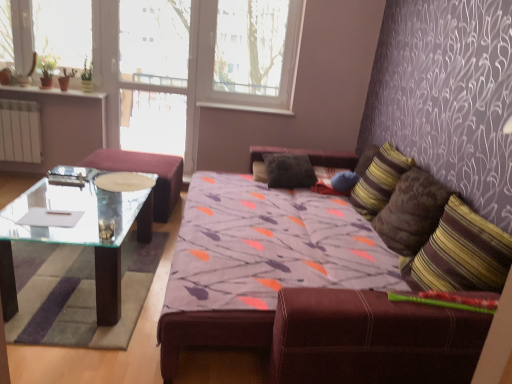
In order to face green glass window screen at upper left, should I rotate leftwards or rightwards?

It's best to rotate left around 25.831 degrees.

Describe the element at coordinates (289, 170) in the screenshot. Image resolution: width=512 pixels, height=384 pixels. I see `black fabric pillow at center, the 3th pillow when ordered from right to left` at that location.

Identify the location of black fabric pillow at center, marked as the first pillow in a back-to-front arrangement. coord(289,170).

Where is `transparent glass coffee table at left`? The height and width of the screenshot is (384, 512). transparent glass coffee table at left is located at coordinates (78, 234).

What is the approximate width of striped fabric pillow at right, the second pillow when ordered from front to back?

The width of striped fabric pillow at right, the second pillow when ordered from front to back, is 13.93 inches.

In order to face striped fabric pillow at right, the second pillow when ordered from front to back, should I rotate leftwards or rightwards?

You should look right and rotate roughly 16.209 degrees.

The height and width of the screenshot is (384, 512). Describe the element at coordinates (145, 172) in the screenshot. I see `transparent glass table at left` at that location.

I want to click on striped fabric pillow at right, so click(x=461, y=253).

In order to click on white paper at left in this screenshot , I will do `click(50, 218)`.

Is striped fabric pillow at right next to green glass window screen at upper left?

No, striped fabric pillow at right is not in contact with green glass window screen at upper left.

From the image's perspective, which object appears higher, striped fabric pillow at right or green glass window screen at upper left?

green glass window screen at upper left, from the image's perspective.

Is striped fabric pillow at right located outside green glass window screen at upper left?

Yes, striped fabric pillow at right is outside of green glass window screen at upper left.

Considering the points (452, 226) and (74, 36), which point is behind, point (452, 226) or point (74, 36)?

The point (74, 36) is farther from the camera.

Is transparent glass coffee table at left with white plastic window frame at upper center?

No, transparent glass coffee table at left is not in contact with white plastic window frame at upper center.

From a real-world perspective, which object stands above the other?

white plastic window frame at upper center.

Where is `coffee table below the white plastic window frame at upper center (from the image's perspective)`? This screenshot has width=512, height=384. coffee table below the white plastic window frame at upper center (from the image's perspective) is located at coordinates (78, 234).

From the picture: Which object is positioned more to the right, white paper at left or striped fabric pillow at right?

striped fabric pillow at right is more to the right.

Can you see white paper at left touching striped fabric pillow at right?

white paper at left is not next to striped fabric pillow at right, and they're not touching.

In the image, is white paper at left positioned in front of or behind striped fabric pillow at right?

white paper at left is behind striped fabric pillow at right.

Who is smaller, white paper at left or striped fabric pillow at right?

white paper at left.

Is the depth of white paper at left greater than that of brown textured pillow at right, the first pillow positioned from the right?

No, it is not.

Can you confirm if white paper at left is taller than brown textured pillow at right, which is counted as the 3th pillow, starting from the left?

In fact, white paper at left may be shorter than brown textured pillow at right, which is counted as the 3th pillow, starting from the left.

Would you say white paper at left is to the left or to the right of brown textured pillow at right, acting as the 3th pillow starting from the back, in the picture?

Based on their positions, white paper at left is located to the left of brown textured pillow at right, acting as the 3th pillow starting from the back.

How far apart are white paper at left and brown textured pillow at right, acting as the 3th pillow starting from the back?

The distance of white paper at left from brown textured pillow at right, acting as the 3th pillow starting from the back, is 7.49 feet.

Which of these two, transparent glass table at left or green glass window screen at upper left, is thinner?

With smaller width is green glass window screen at upper left.

Consider the image. Is transparent glass table at left oriented towards green glass window screen at upper left?

No, transparent glass table at left is not oriented towards green glass window screen at upper left.

Is point (174, 164) farther from camera compared to point (58, 22)?

No, (174, 164) is closer to viewer.

Considering the positions of objects transparent glass table at left and green glass window screen at upper left in the image provided, who is in front, transparent glass table at left or green glass window screen at upper left?

Positioned in front is transparent glass table at left.

Where is `pad on the left of the white plastic window sill at upper center`? The width and height of the screenshot is (512, 384). pad on the left of the white plastic window sill at upper center is located at coordinates (50, 218).

Considering the sizes of objects white plastic window sill at upper center and white paper at left in the image provided, who is shorter, white plastic window sill at upper center or white paper at left?

white paper at left is shorter.

From a real-world perspective, who is located higher, white plastic window sill at upper center or white paper at left?

white plastic window sill at upper center, from a real-world perspective.

From the image's perspective, who appears lower, white plastic window sill at upper center or white paper at left?

white paper at left, from the image's perspective.

Could you tell me if white plastic window sill at upper center is turned towards striped fabric pillow at right?

No, white plastic window sill at upper center does not turn towards striped fabric pillow at right.

From the image's perspective, is white plastic window sill at upper center over striped fabric pillow at right?

Yes.

Is there a large distance between white plastic window sill at upper center and striped fabric pillow at right?

That's right, there is a large distance between white plastic window sill at upper center and striped fabric pillow at right.

Which is more to the left, white plastic window sill at upper center or striped fabric pillow at right?

white plastic window sill at upper center is more to the left.

Where is `window screen on the left of striped fabric pillow at right`? window screen on the left of striped fabric pillow at right is located at coordinates [x=63, y=32].

In order to click on coffee table below the white plastic window frame at upper center (from a real-world perspective) in this screenshot , I will do `click(78, 234)`.

Estimate the real-world distances between objects in this image. Which object is further from white paper at left, transparent glass coffee table at left or black fabric pillow at center, the 3th pillow when ordered from right to left?

black fabric pillow at center, the 3th pillow when ordered from right to left, lies further to white paper at left than the other object.

Based on their spatial positions, is transparent glass table at left or black fabric pillow at center, the 3th pillow when ordered from right to left, further from white plastic window sill at upper center?

transparent glass table at left lies further to white plastic window sill at upper center than the other object.

Which object lies nearer to the anchor point white plastic window sill at upper center, white paper at left or transparent glass table at left?

Among the two, transparent glass table at left is located nearer to white plastic window sill at upper center.

Which object lies further to the anchor point transparent glass coffee table at left, brown textured pillow at right, acting as the 3th pillow starting from the back, or transparent glass door at upper center?

brown textured pillow at right, acting as the 3th pillow starting from the back, lies further to transparent glass coffee table at left than the other object.

Based on their spatial positions, is transparent glass table at left or transparent glass door at upper center further from brown textured pillow at right, acting as the 3th pillow starting from the back?

Among the two, transparent glass door at upper center is located further to brown textured pillow at right, acting as the 3th pillow starting from the back.

Based on their spatial positions, is striped fabric pillow at right or transparent glass coffee table at left closer to white paper at left?

transparent glass coffee table at left is closer to white paper at left.

When comparing their distances from striped fabric pillow at right, does black fabric pillow at center, the 3th pillow when ordered from right to left, or transparent glass coffee table at left seem closer?

Among the two, black fabric pillow at center, the 3th pillow when ordered from right to left, is located nearer to striped fabric pillow at right.

From the image, which object appears to be farther from striped fabric pillow at right, the second pillow when ordered from front to back, brown textured pillow at right, acting as the 3th pillow starting from the back, or green glass window screen at upper left?

green glass window screen at upper left.

You are a GUI agent. You are given a task and a screenshot of the screen. Output one action in this format:
    pyautogui.click(x=<x>, y=<y>)
    Task: Click on the chair between green glass window screen at upper left and black fabric pillow at center, the 3th pillow when ordered from right to left, in the horizontal direction
    
    Given the screenshot: What is the action you would take?
    pyautogui.click(x=145, y=172)

This screenshot has width=512, height=384. Find the location of `window sill that lies between white plastic window frame at upper center and transparent glass table at left from top to bottom`. window sill that lies between white plastic window frame at upper center and transparent glass table at left from top to bottom is located at coordinates (245, 108).

This screenshot has height=384, width=512. I want to click on glass door located between green glass window screen at upper left and brown textured pillow at right, which is counted as the 3th pillow, starting from the left, in the left-right direction, so click(x=158, y=77).

Locate an element on the screen. glass door situated between transparent glass table at left and white plastic window sill at upper center from left to right is located at coordinates (158, 77).